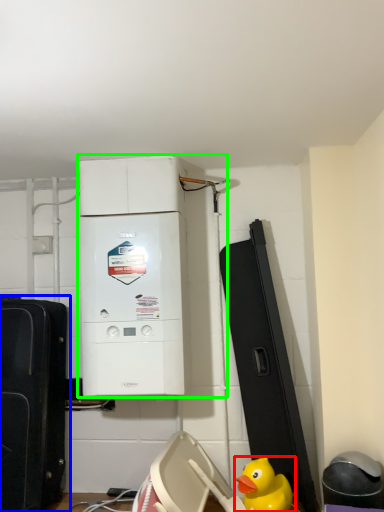
Question: Estimate the real-world distances between objects in this image. Which object is farther from duck (highlighted by a red box), toy (highlighted by a blue box) or home appliance (highlighted by a green box)?

Choices:
 (A) toy
 (B) home appliance

Answer: (A)